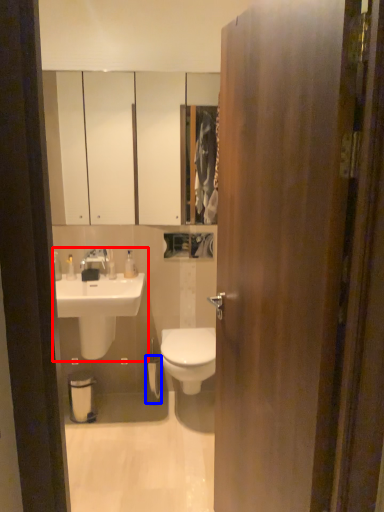
Question: Which object appears closest to the camera in this image, sink (highlighted by a red box) or toilet paper (highlighted by a blue box)?

Choices:
 (A) sink
 (B) toilet paper

Answer: (A)